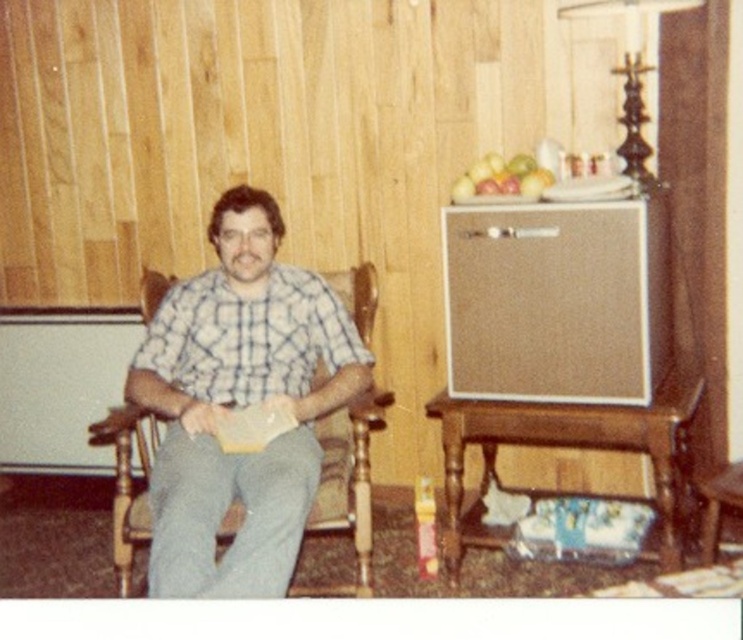
You are a photographer setting up a shoot in this vintage room. You need to ensure that the checkered fabric shirt at center and the green matte apple at upper center are both visible in the frame. Based on their positions, which object is closer to the camera?

The checkered fabric shirt at center is closer to the camera because it is in front of the green matte apple at upper center.